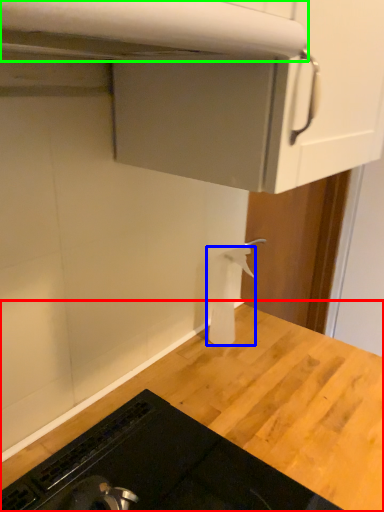
Question: Which object is positioned farthest from countertop (highlighted by a red box)? Select from toilet paper (highlighted by a blue box) and exhaust hood (highlighted by a green box).

Choices:
 (A) toilet paper
 (B) exhaust hood

Answer: (B)